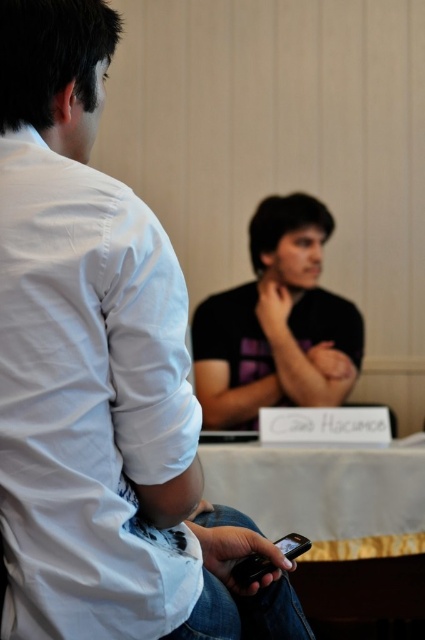
Question: Among these objects, which one is nearest to the camera?

Choices:
 (A) matte black smartphone at lower center
 (B) black matte shirt at center

Answer: (A)

Question: Which of the following is the farthest from the observer?

Choices:
 (A) (44, 180)
 (B) (255, 260)
 (C) (297, 545)

Answer: (B)

Question: Can you confirm if black matte shirt at center is wider than matte black smartphone at lower center?

Choices:
 (A) no
 (B) yes

Answer: (B)

Question: Can you confirm if black matte shirt at center is thinner than matte black smartphone at lower center?

Choices:
 (A) yes
 (B) no

Answer: (B)

Question: Which point is closer to the camera?

Choices:
 (A) (263, 362)
 (B) (206, 458)
 (C) (74, 589)

Answer: (C)

Question: Is matte black phone at center to the left of white fabric table at center from the viewer's perspective?

Choices:
 (A) no
 (B) yes

Answer: (B)